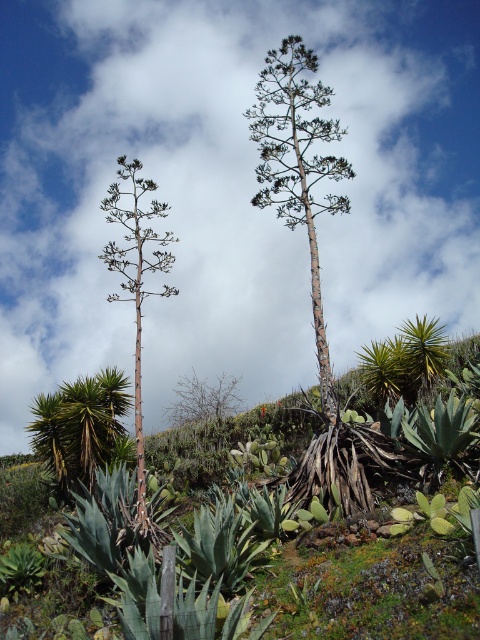
Can you confirm if white fluffy cloud at upper center is shorter than greenish-brown bark tree at center?

Incorrect, white fluffy cloud at upper center's height does not fall short of greenish-brown bark tree at center's.

Which is more to the right, white fluffy cloud at upper center or greenish-brown bark tree at center?

Positioned to the right is greenish-brown bark tree at center.

Find the location of a particular element. The width and height of the screenshot is (480, 640). white fluffy cloud at upper center is located at coordinates (228, 188).

Does white fluffy cloud at upper center have a smaller size compared to green spiky plant at left?

No, white fluffy cloud at upper center is not smaller than green spiky plant at left.

Does point (266, 276) lie behind point (136, 387)?

Yes.

The width and height of the screenshot is (480, 640). I want to click on white fluffy cloud at upper center, so [x=228, y=188].

Who is lower down, greenish-brown bark tree at center or green spiky plant at left?

green spiky plant at left

Is greenish-brown bark tree at center further to the viewer compared to green spiky plant at left?

Yes, greenish-brown bark tree at center is behind green spiky plant at left.

This screenshot has height=640, width=480. I want to click on greenish-brown bark tree at center, so click(298, 164).

Find the location of a particular element. greenish-brown bark tree at center is located at coordinates (298, 164).